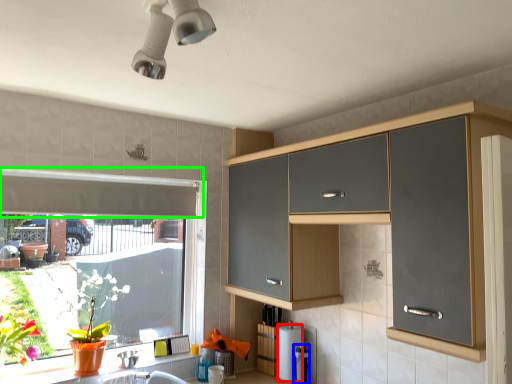
Question: Based on their relative distances, which object is nearer to toilet paper (highlighted by a red box)? Choose from appliance (highlighted by a blue box) and exhaust hood (highlighted by a green box).

Choices:
 (A) appliance
 (B) exhaust hood

Answer: (A)